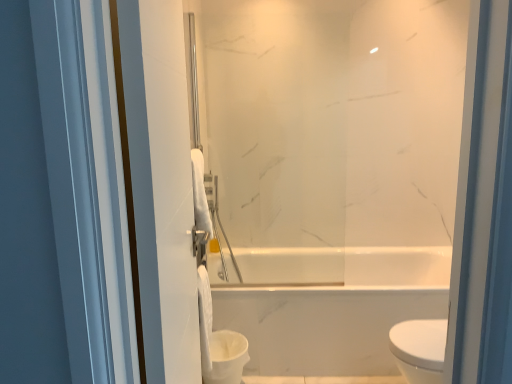
What is the approximate height of white glossy towel at left?

The height of white glossy towel at left is 4.94 feet.

Identify the location of white plastic toilet bowl at lower left. (226, 357).

Does white plastic toilet bowl at lower left have a lesser height compared to white matte toilet paper at center?

Correct, white plastic toilet bowl at lower left is not as tall as white matte toilet paper at center.

Does point (211, 351) come in front of point (204, 351)?

No, (211, 351) is behind (204, 351).

From a real-world perspective, which is physically above, white plastic toilet bowl at lower left or white matte toilet paper at center?

white matte toilet paper at center, from a real-world perspective.

Can you confirm if white matte toilet paper at center is shorter than white plastic toilet bowl at lower left?

In fact, white matte toilet paper at center may be taller than white plastic toilet bowl at lower left.

Is the depth of white matte toilet paper at center greater than that of white plastic toilet bowl at lower left?

No, the depth of white matte toilet paper at center is less than that of white plastic toilet bowl at lower left.

Can you see white matte toilet paper at center touching white plastic toilet bowl at lower left?

There is a gap between white matte toilet paper at center and white plastic toilet bowl at lower left.

Measure the distance from white matte toilet paper at center to white plastic toilet bowl at lower left.

white matte toilet paper at center and white plastic toilet bowl at lower left are 5.71 inches apart.

Is white glossy towel at left facing away from white matte toilet paper at center?

white glossy towel at left is not turned away from white matte toilet paper at center.

Does point (167, 314) come closer to viewer compared to point (198, 276)?

Yes, point (167, 314) is closer to viewer.

Is white glossy towel at left situated inside white matte toilet paper at center or outside?

white glossy towel at left is located beyond the bounds of white matte toilet paper at center.

Which object is positioned more to the right, white glossy towel at left or white matte toilet paper at center?

Positioned to the right is white glossy towel at left.

Is white plastic toilet bowl at lower left beside white glossy towel at left?

white plastic toilet bowl at lower left and white glossy towel at left are clearly separated.

Which is correct: white plastic toilet bowl at lower left is inside white glossy towel at left, or outside of it?

white plastic toilet bowl at lower left is not inside white glossy towel at left, it's outside.

Does point (233, 336) lie in front of point (143, 201)?

No, (233, 336) is behind (143, 201).

Would you say white glossy towel at left is part of white matte toilet paper at center's contents?

That's incorrect, white glossy towel at left is not inside white matte toilet paper at center.

Between white matte toilet paper at center and white glossy towel at left, which one appears on the left side from the viewer's perspective?

From the viewer's perspective, white matte toilet paper at center appears more on the left side.

From a real-world perspective, is white matte toilet paper at center physically located above or below white glossy towel at left?

white matte toilet paper at center is below white glossy towel at left.

Identify the location of toilet bowl that is below the white glossy towel at left (from the image's perspective). This screenshot has height=384, width=512. (226, 357).

Is white glossy towel at left oriented towards white plastic toilet bowl at lower left?

No, white glossy towel at left does not turn towards white plastic toilet bowl at lower left.

Is white glossy towel at left inside the boundaries of white plastic toilet bowl at lower left, or outside?

The correct answer is: outside.

Identify the location of toilet bowl on the right of white matte toilet paper at center. This screenshot has height=384, width=512. (226, 357).

Where is `toilet bowl below the white matte toilet paper at center (from a real-world perspective)`? This screenshot has height=384, width=512. toilet bowl below the white matte toilet paper at center (from a real-world perspective) is located at coordinates (226, 357).

Consider the image. Considering their positions, is white glossy towel at left positioned closer to white plastic toilet bowl at lower left than white matte toilet paper at center?

white matte toilet paper at center is closer to white plastic toilet bowl at lower left.

Looking at the image, which one is located further to white glossy towel at left, white matte toilet paper at center or white plastic toilet bowl at lower left?

The object further to white glossy towel at left is white plastic toilet bowl at lower left.

When comparing their distances from white matte toilet paper at center, does white glossy towel at left or white plastic toilet bowl at lower left seem further?

white glossy towel at left.

From the image, which object appears to be nearer to white plastic toilet bowl at lower left, white matte toilet paper at center or white glossy towel at left?

The object closer to white plastic toilet bowl at lower left is white matte toilet paper at center.

From the image, which object appears to be nearer to white glossy towel at left, white plastic toilet bowl at lower left or white matte toilet paper at center?

white matte toilet paper at center is closer to white glossy towel at left.

Considering their positions, is white plastic toilet bowl at lower left positioned further to white matte toilet paper at center than white glossy towel at left?

white glossy towel at left lies further to white matte toilet paper at center than the other object.

Identify the location of toilet paper between white glossy towel at left and white plastic toilet bowl at lower left from front to back. (205, 317).